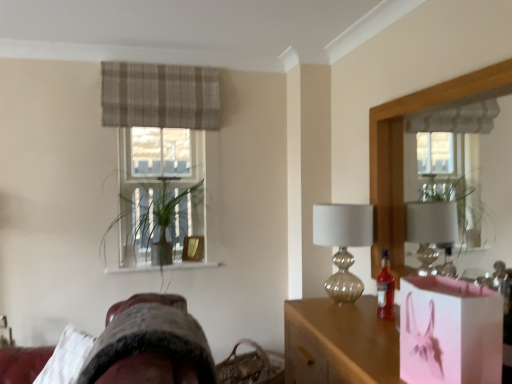
Locate an element on the screen. The image size is (512, 384). free space in front of translucent glass table lamp at center right is located at coordinates (333, 324).